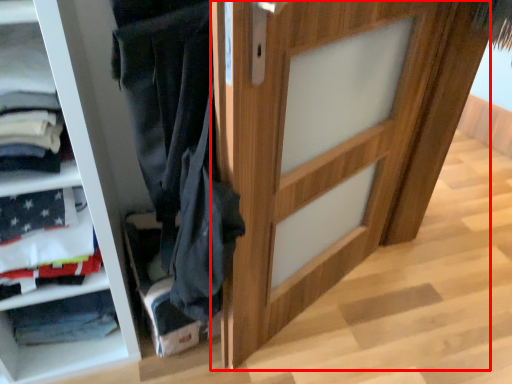
Question: Observing the image, what is the correct spatial positioning of door (annotated by the red box) in reference to shelf?

Choices:
 (A) left
 (B) right

Answer: (B)